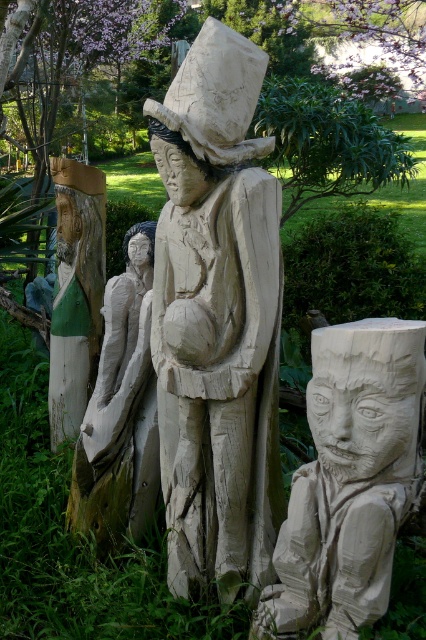
This screenshot has width=426, height=640. In order to click on carved wood face at lower right in this screenshot , I will do `click(350, 480)`.

The width and height of the screenshot is (426, 640). What do you see at coordinates (350, 480) in the screenshot?
I see `carved wood face at lower right` at bounding box center [350, 480].

Identify the location of carved wood face at lower right. 350,480.

Is natural wood statue at center thinner than natural wood carving at center?

In fact, natural wood statue at center might be wider than natural wood carving at center.

Is natural wood statue at center to the right of natural wood carving at center from the viewer's perspective?

Yes, natural wood statue at center is to the right of natural wood carving at center.

Where is `natural wood statue at center`? The height and width of the screenshot is (640, 426). natural wood statue at center is located at coordinates 216,320.

Who is more forward, (x=160, y=269) or (x=291, y=486)?

Positioned in front is point (x=291, y=486).

Where is `natural wood statue at center`? natural wood statue at center is located at coordinates (216, 320).

At what (x,y) coordinates should I click in order to perform the action: click on natural wood statue at center. Please return your answer as a coordinate pair (x, y). The image size is (426, 640). Looking at the image, I should click on (216, 320).